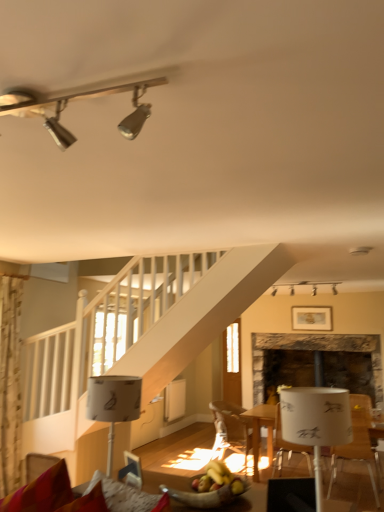
Question: In the image, is metallic track lighting at upper left, the 3th lamp when ordered from bottom to top, positioned in front of or behind white paper lampshade at lower left, which is the 3th lamp from top to bottom?

Choices:
 (A) front
 (B) behind

Answer: (A)

Question: Choose the correct answer: Is metallic track lighting at upper left, the 3th lamp when ordered from bottom to top, inside white paper lampshade at lower left, the second lamp from the back, or outside it?

Choices:
 (A) outside
 (B) inside

Answer: (A)

Question: Considering the real-world distances, which object is farthest from the wooden bowl of fruit at lower center?

Choices:
 (A) white plastic chair at lower right, arranged as the 1th chair when viewed from the right
 (B) velvet red couch at lower left
 (C) stone fireplace at center
 (D) wooden framed picture at upper center
 (E) clear glass door at center

Answer: (E)

Question: Considering the real-world distances, which object is closest to the floral fabric curtain at left?

Choices:
 (A) metallic track lighting at upper left, positioned as the 2th lamp in left-to-right order
 (B) white plastic chair at lower right, which is counted as the second chair, starting from the left
 (C) wooden chair at center, which is the first chair in back-to-front order
 (D) velvet red couch at lower left
 (E) stone fireplace at center

Answer: (D)